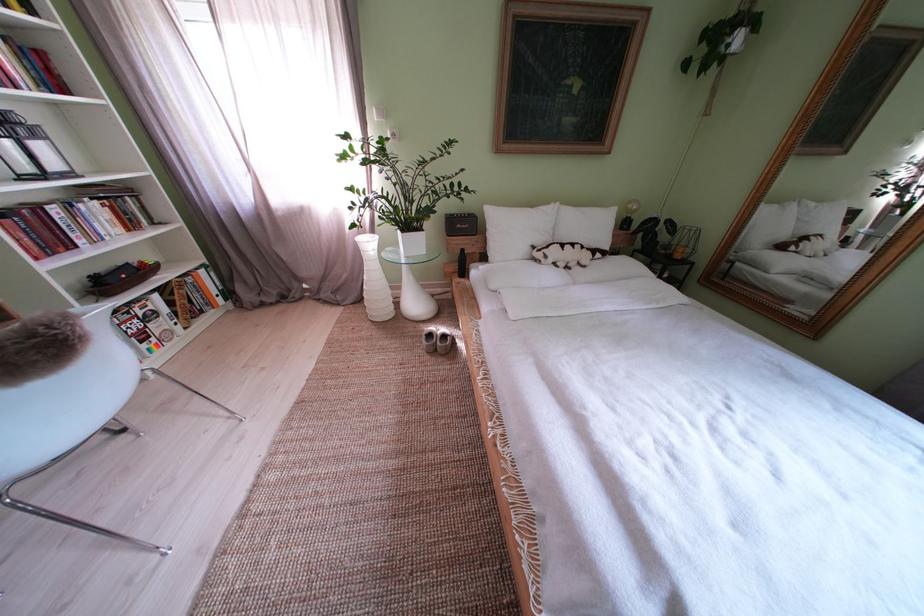
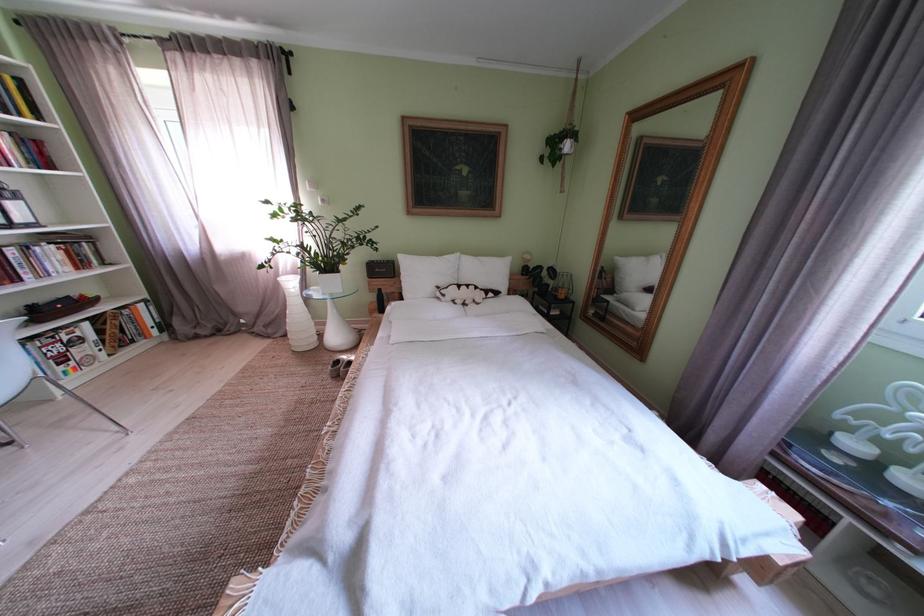
Find the pixel in the second image that matches point 442,341 in the first image.

(348, 367)